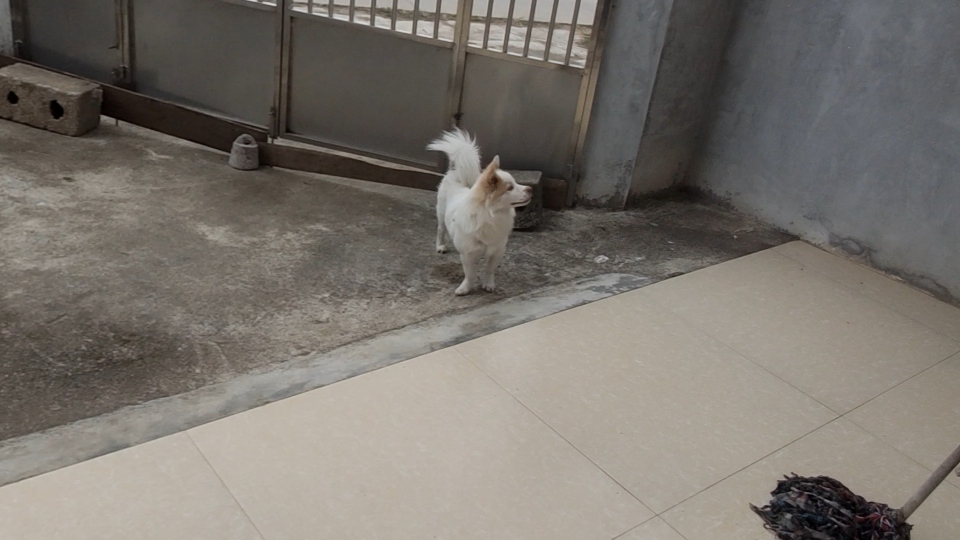
Image resolution: width=960 pixels, height=540 pixels. I want to click on busted up concrete floor, so click(40, 170), click(60, 389), click(369, 309), click(190, 185), click(197, 256), click(684, 237).